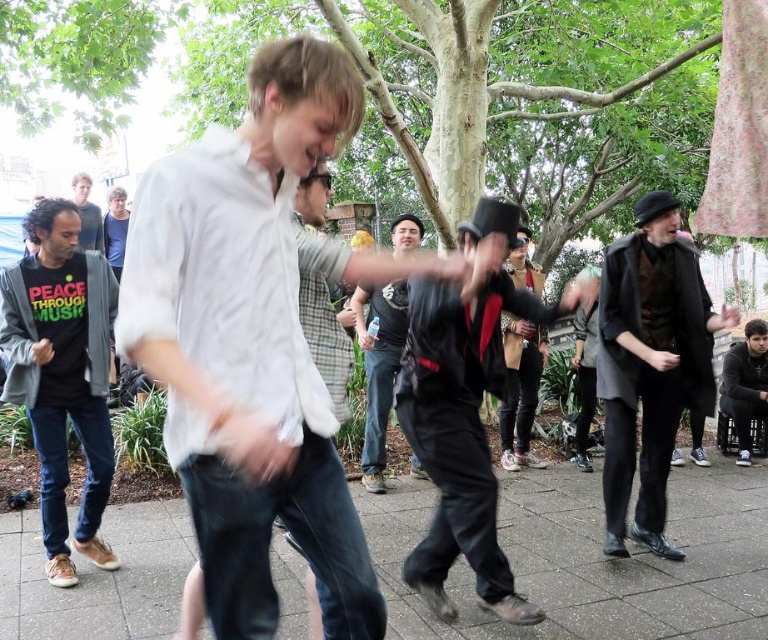
Question: Which point appears closest to the camera in this image?

Choices:
 (A) (83, 209)
 (B) (515, 262)
 (C) (266, 440)

Answer: (C)

Question: Can you confirm if white cotton shirt at center is thinner than gray concrete pavement at center?

Choices:
 (A) yes
 (B) no

Answer: (A)

Question: Which of the following is the farthest from the observer?

Choices:
 (A) (766, 477)
 (B) (88, 182)
 (C) (651, 456)
 (D) (518, 323)

Answer: (B)

Question: In this image, where is white cotton shirt at center located relative to dark gray wool coat at right?

Choices:
 (A) above
 (B) below

Answer: (A)

Question: Estimate the real-world distances between objects in this image. Which object is closer to the matte black jacket at center?

Choices:
 (A) gray concrete pavement at center
 (B) black leather jacket at center
 (C) white cotton shirt at center

Answer: (A)

Question: Can you confirm if white cotton shirt at center is smaller than dark gray hoodie at lower right?

Choices:
 (A) no
 (B) yes

Answer: (A)